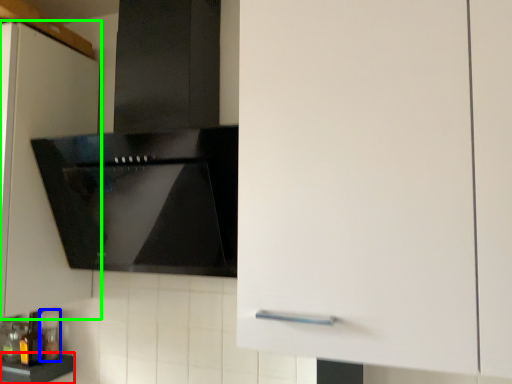
Question: Considering the real-world distances, which object is closest to counter top (highlighted by a red box)? bottle (highlighted by a blue box) or cabinetry (highlighted by a green box).

Choices:
 (A) bottle
 (B) cabinetry

Answer: (A)